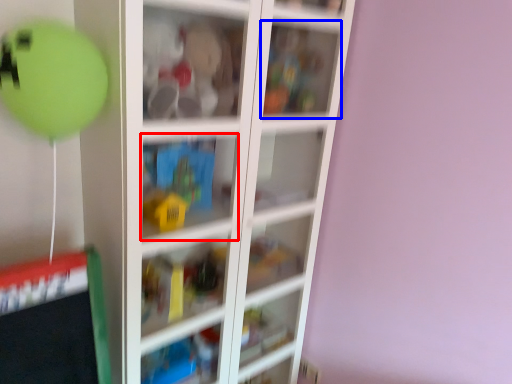
Question: Which point is further to the camera, cabinet (highlighted by a red box) or cabinet (highlighted by a blue box)?

Choices:
 (A) cabinet
 (B) cabinet

Answer: (B)